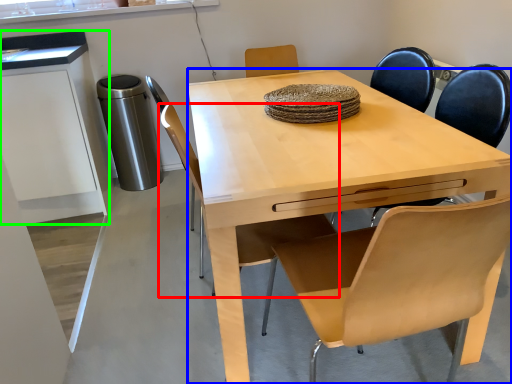
Question: Considering the real-world distances, which object is closest to chair (highlighted by a red box)? desk (highlighted by a blue box) or cabinetry (highlighted by a green box).

Choices:
 (A) desk
 (B) cabinetry

Answer: (A)